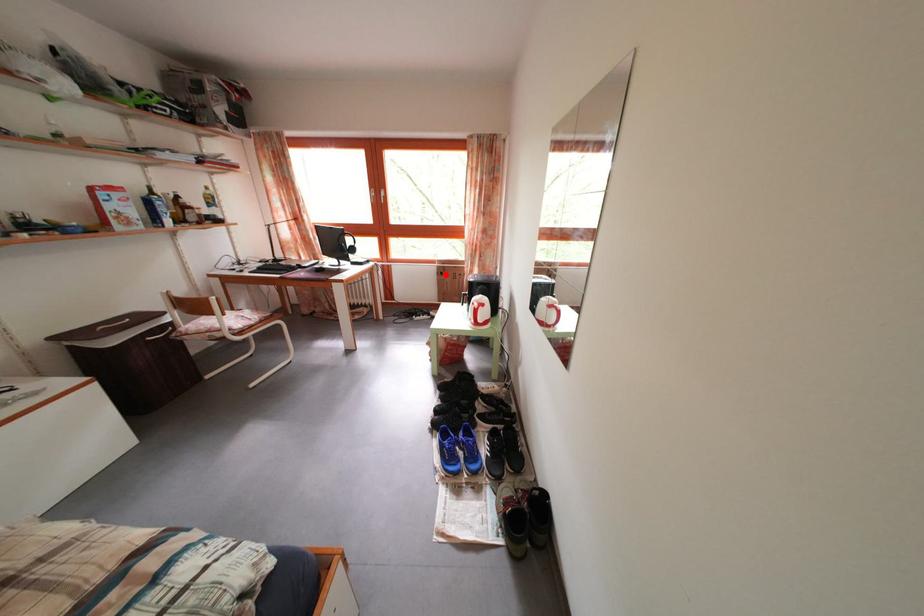
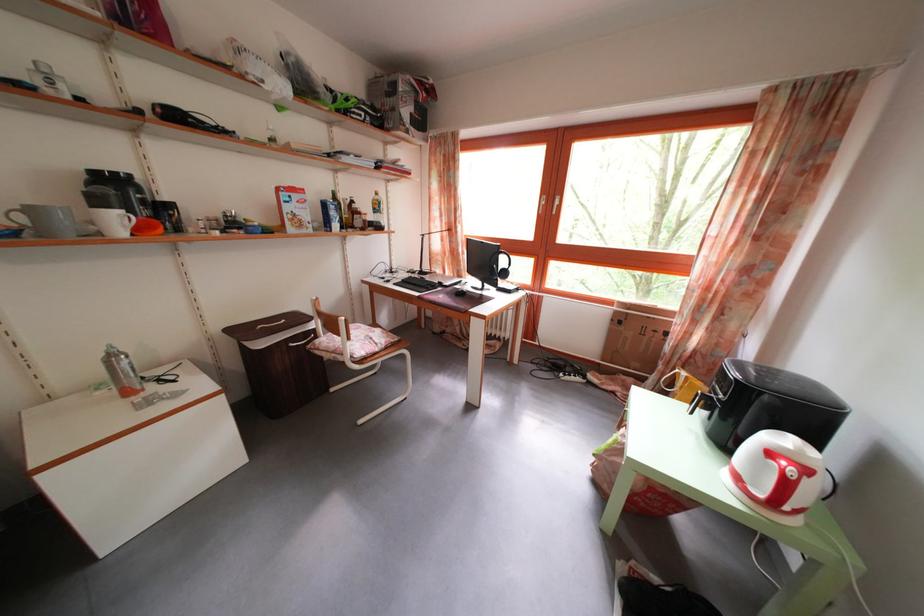
Locate, in the second image, the point that corresponds to the highlighted location in the first image.

(623, 320)